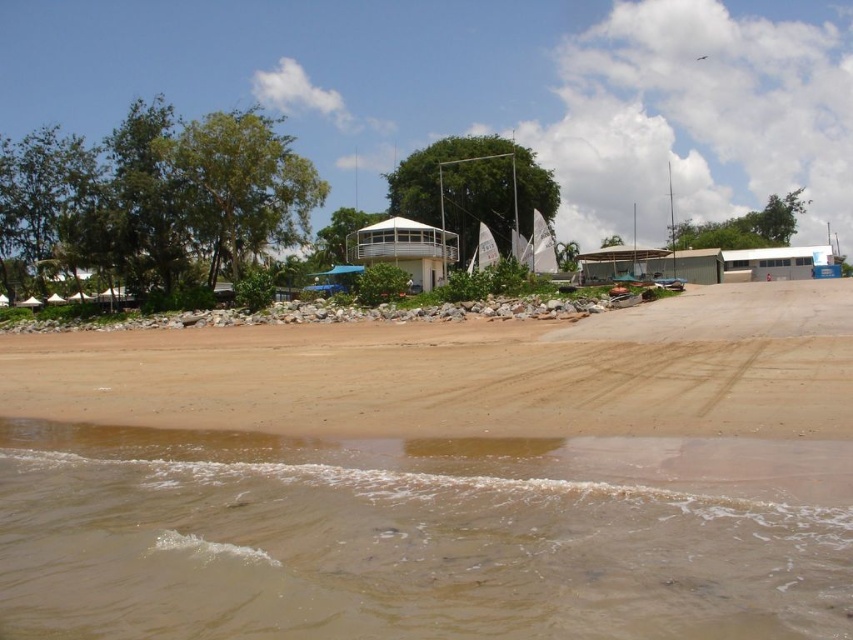
Can you confirm if brown sandy water at lower left is positioned above brown sand at lower center?

Incorrect, brown sandy water at lower left is not positioned above brown sand at lower center.

Is brown sandy water at lower left further to the viewer compared to brown sand at lower center?

That is False.

Is point (314, 589) farther from viewer compared to point (247, 333)?

No, (314, 589) is closer to viewer.

Find the location of `brown sandy water at lower left`. brown sandy water at lower left is located at coordinates (419, 536).